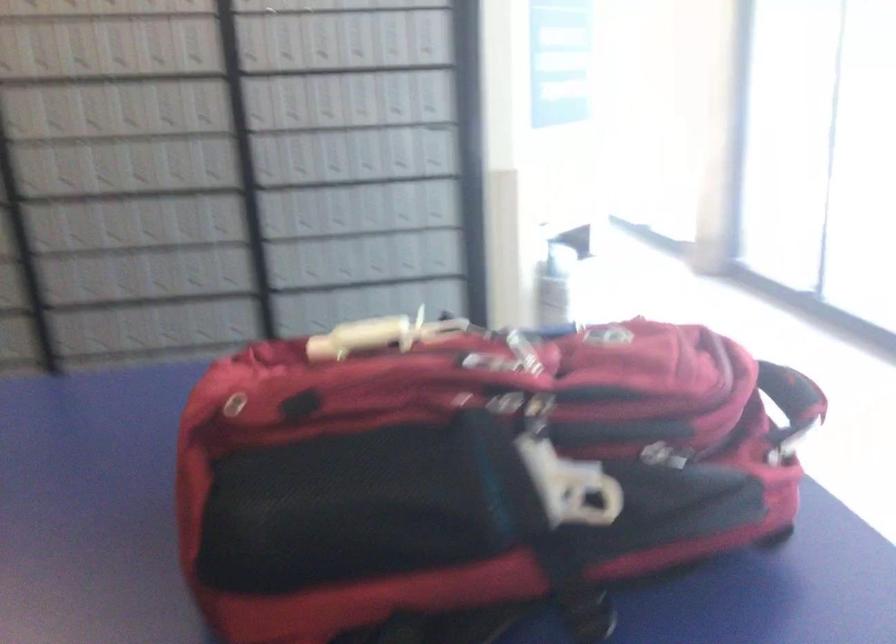
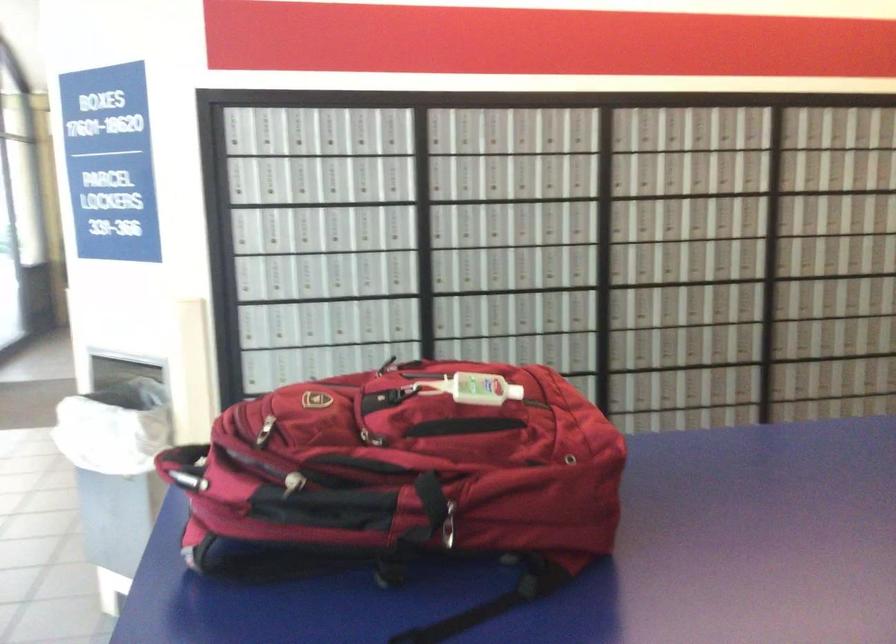
The point at (733,379) is marked in the first image. Where is the corresponding point in the second image?

(185, 466)